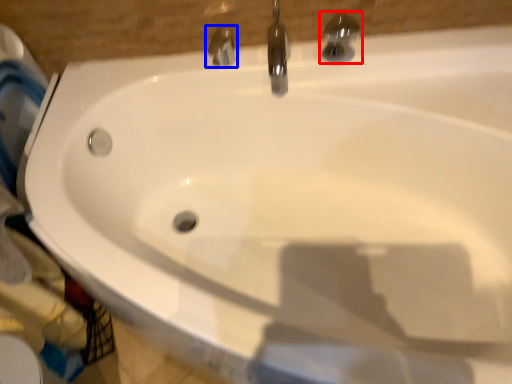
Question: Which object appears farthest to the camera in this image, tap (highlighted by a red box) or tap (highlighted by a blue box)?

Choices:
 (A) tap
 (B) tap

Answer: (B)